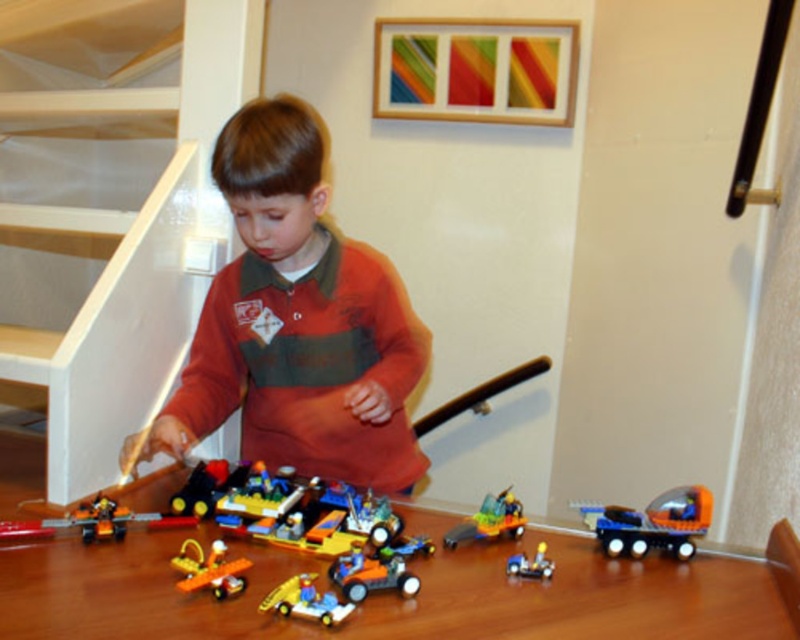
Can you confirm if brown wooden table at center is positioned above blue plastic truck at lower right?

No, brown wooden table at center is not above blue plastic truck at lower right.

Can you confirm if brown wooden table at center is shorter than blue plastic truck at lower right?

No.

Locate an element on the screen. This screenshot has height=640, width=800. brown wooden table at center is located at coordinates [x=390, y=595].

Locate an element on the screen. brown wooden table at center is located at coordinates (390, 595).

Can you confirm if orange matte shirt at center is positioned to the left of orange matte car at lower left?

In fact, orange matte shirt at center is to the right of orange matte car at lower left.

Between point (264, 448) and point (100, 512), which one is positioned behind?

The point (264, 448) is more distant.

Image resolution: width=800 pixels, height=640 pixels. Identify the location of orange matte shirt at center. (298, 321).

Which is more to the right, translucent yellow car at center or translucent orange car at center?

Positioned to the right is translucent orange car at center.

Does translucent yellow car at center have a greater width compared to translucent orange car at center?

Incorrect, translucent yellow car at center's width does not surpass translucent orange car at center's.

Who is more distant from viewer, (x=324, y=620) or (x=488, y=538)?

Positioned behind is point (x=488, y=538).

You are a GUI agent. You are given a task and a screenshot of the screen. Output one action in this format:
    pyautogui.click(x=<x>, y=<y>)
    Task: Click on the translucent yellow car at center
    The width and height of the screenshot is (800, 640).
    Given the screenshot: What is the action you would take?
    pyautogui.click(x=306, y=600)